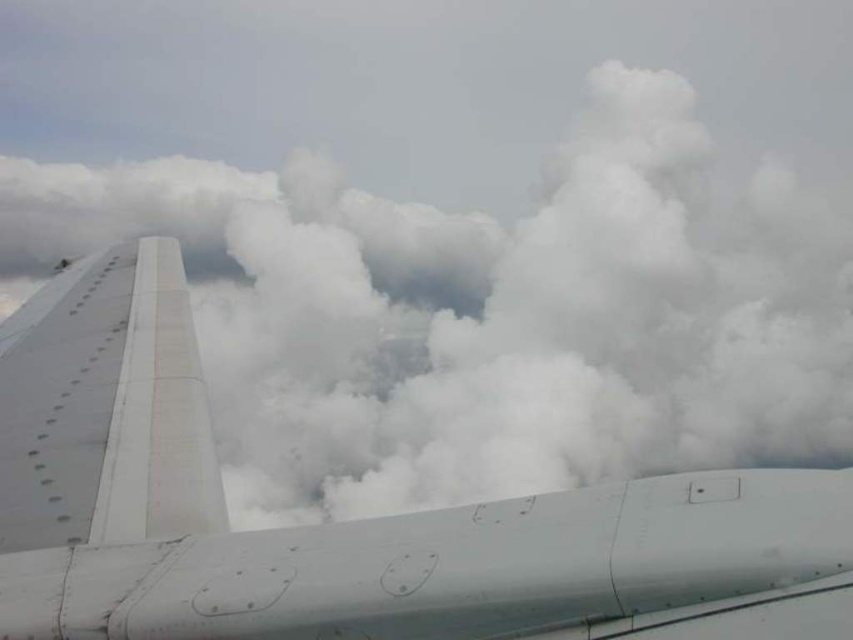
Between white matte airplane wing at left and white matte wing at left, which one is positioned lower?

white matte airplane wing at left is lower down.

Does white matte airplane wing at left have a greater height compared to white matte wing at left?

No, white matte airplane wing at left is not taller than white matte wing at left.

Measure the distance between white matte airplane wing at left and camera.

white matte airplane wing at left and camera are 4.12 feet apart from each other.

Image resolution: width=853 pixels, height=640 pixels. I want to click on white matte airplane wing at left, so click(x=346, y=522).